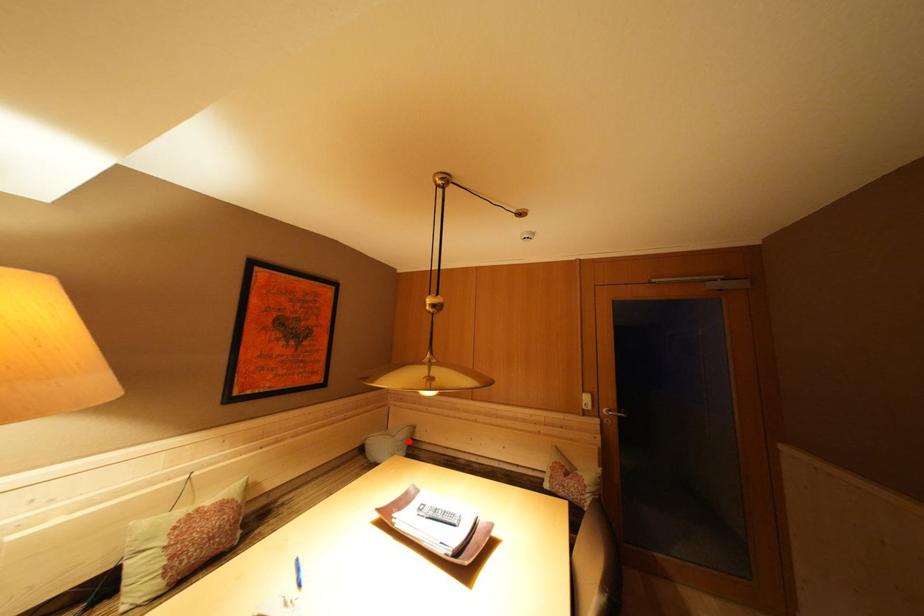
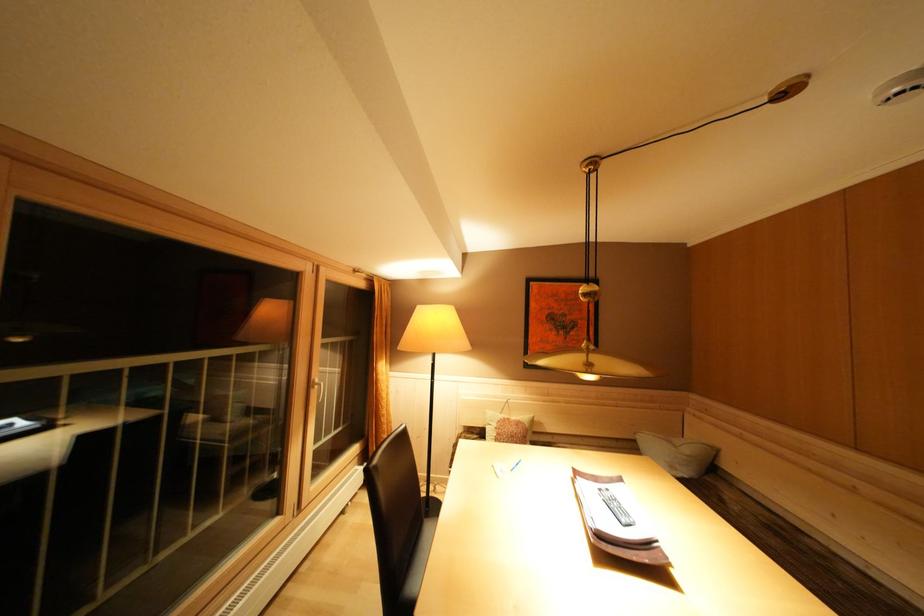
In the second image, find the point that corresponds to the highlighted location in the first image.

(695, 456)